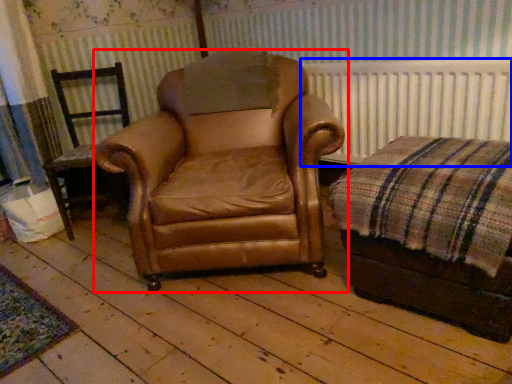
Question: Which object is closer to the camera taking this photo, chair (highlighted by a red box) or radiator (highlighted by a blue box)?

Choices:
 (A) chair
 (B) radiator

Answer: (A)